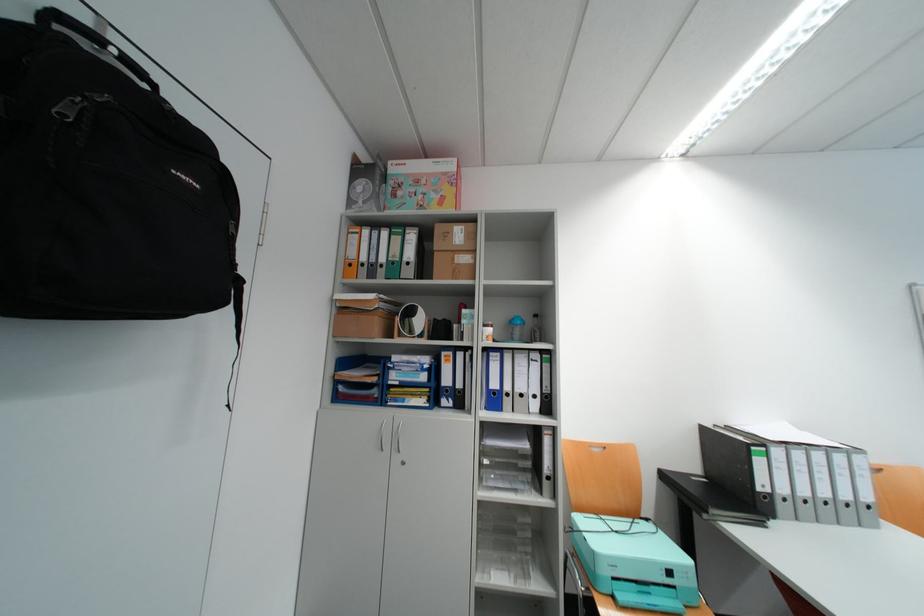
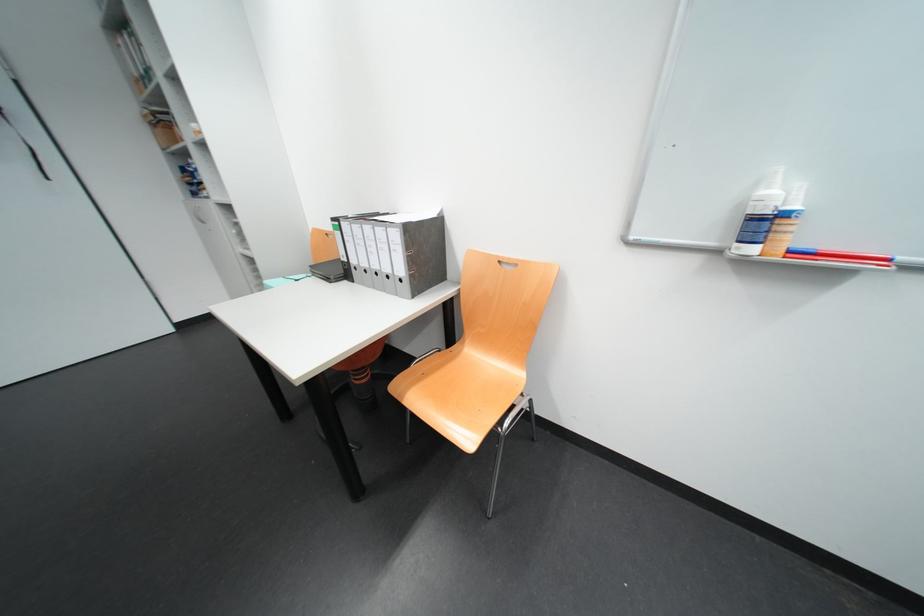
Question: I am providing you with two images of the same scene from different viewpoints. After the viewpoint changes to image2, which objects are now occluded?

Choices:
 (A) yellow floor mat
 (B) white spray bottle
 (C) Canon printer box
 (D) black door handle

Answer: (C)